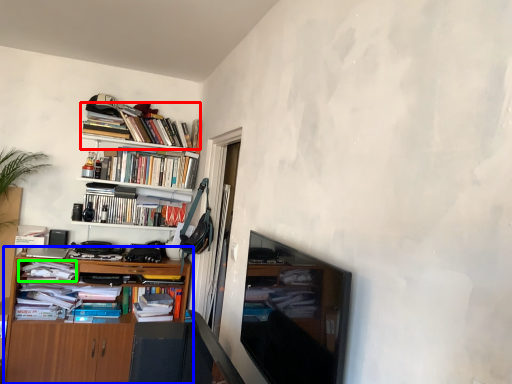
Question: Which object is the farthest from book (highlighted by a red box)? Choose among these: cabinetry (highlighted by a blue box) or magazine (highlighted by a green box).

Choices:
 (A) cabinetry
 (B) magazine

Answer: (A)